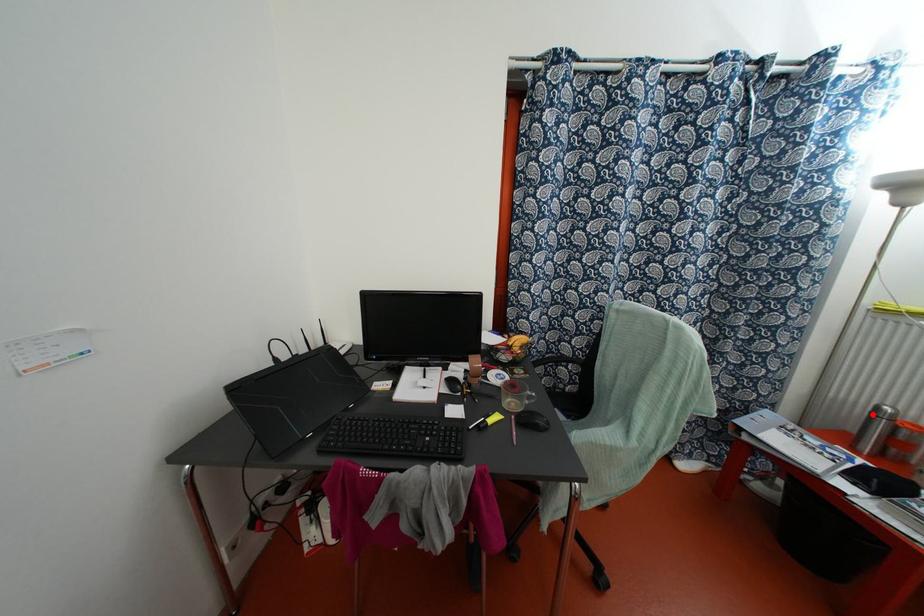
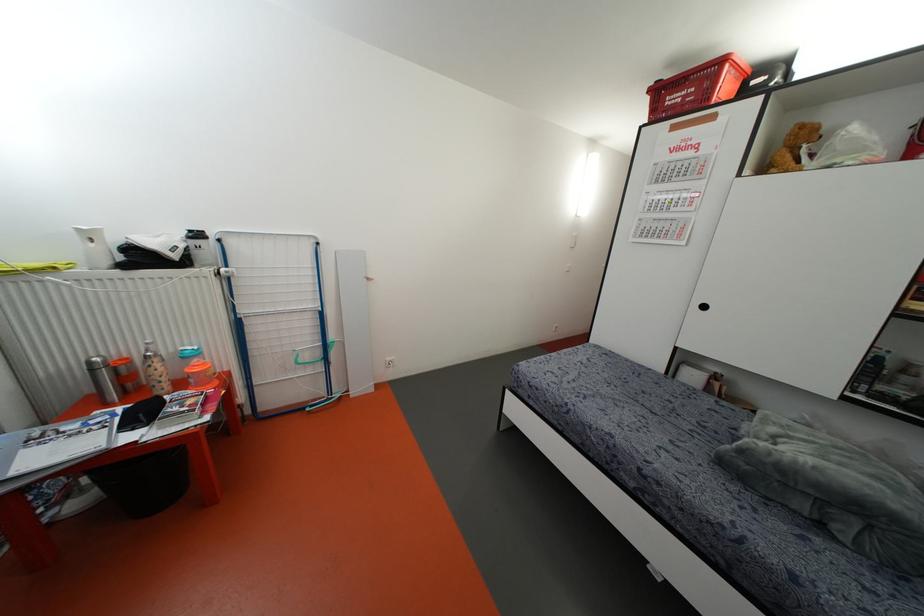
Question: I am providing you with two images of the same scene from different viewpoints. Image1 has a red point marked. In image2, the corresponding 3D location appears at what relative position? Reply with the corresponding letter.

Choices:
 (A) Closer
 (B) Farther

Answer: (A)